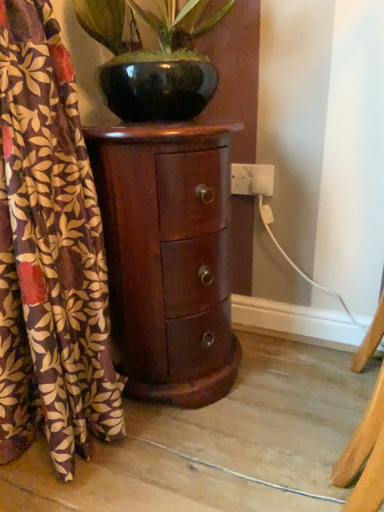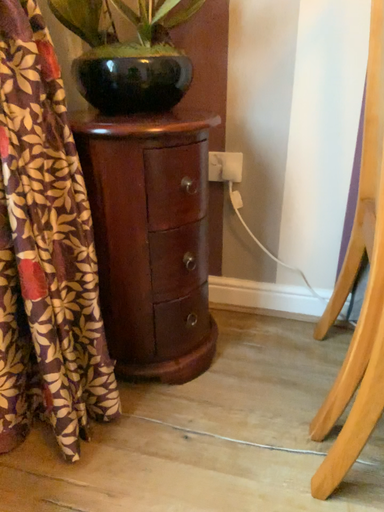
Question: How did the camera likely rotate when shooting the video?

Choices:
 (A) rotated left
 (B) rotated right

Answer: (B)